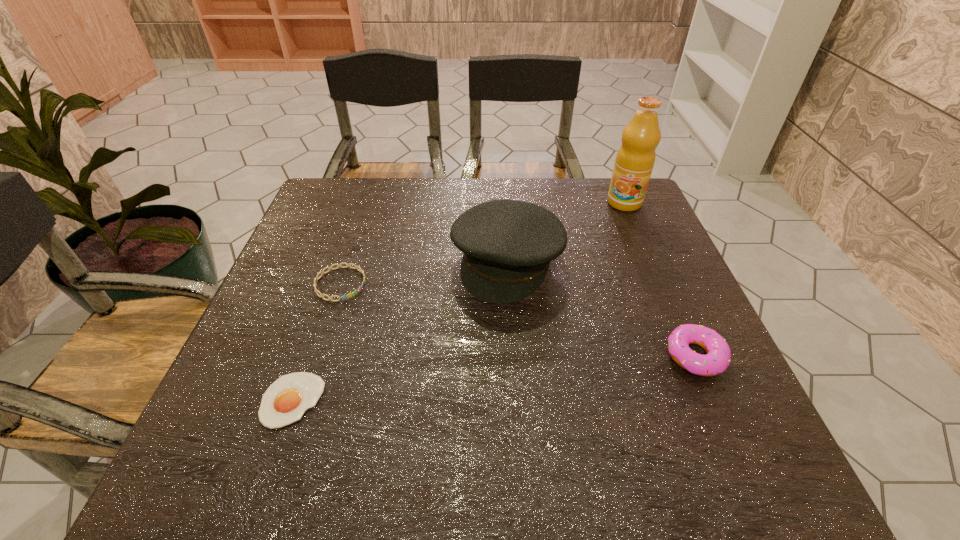
Image resolution: width=960 pixels, height=540 pixels. Identify the location of blank area located on the surface of the bracelet showing star-shaped elements. (447, 352).

Find the location of a particular element. The image size is (960, 540). free space located 0.050m on the surface of the bracelet showing star-shaped elements is located at coordinates point(372,305).

Image resolution: width=960 pixels, height=540 pixels. Identify the location of blank space located on the front-facing side of the fourth shortest object. (438, 410).

Locate an element on the screen. This screenshot has width=960, height=540. blank area located on the front-facing side of the fourth shortest object is located at coordinates (470, 340).

Where is `free region located 0.180m on the front-facing side of the fourth shortest object`? free region located 0.180m on the front-facing side of the fourth shortest object is located at coordinates (460, 363).

At what (x,y) coordinates should I click in order to perform the action: click on vacant space located on the front label of the fruit juice. Please return your answer as a coordinate pair (x, y). Image resolution: width=960 pixels, height=540 pixels. Looking at the image, I should click on (591, 268).

Find the location of a particular element. The height and width of the screenshot is (540, 960). vacant space located on the front label of the fruit juice is located at coordinates (585, 280).

This screenshot has width=960, height=540. Find the location of `free space located 0.060m on the front label of the fruit juice`. free space located 0.060m on the front label of the fruit juice is located at coordinates (614, 222).

The width and height of the screenshot is (960, 540). Find the location of `object that is at the far edge`. object that is at the far edge is located at coordinates (635, 159).

The width and height of the screenshot is (960, 540). Identify the location of object located at the near edge. (285, 401).